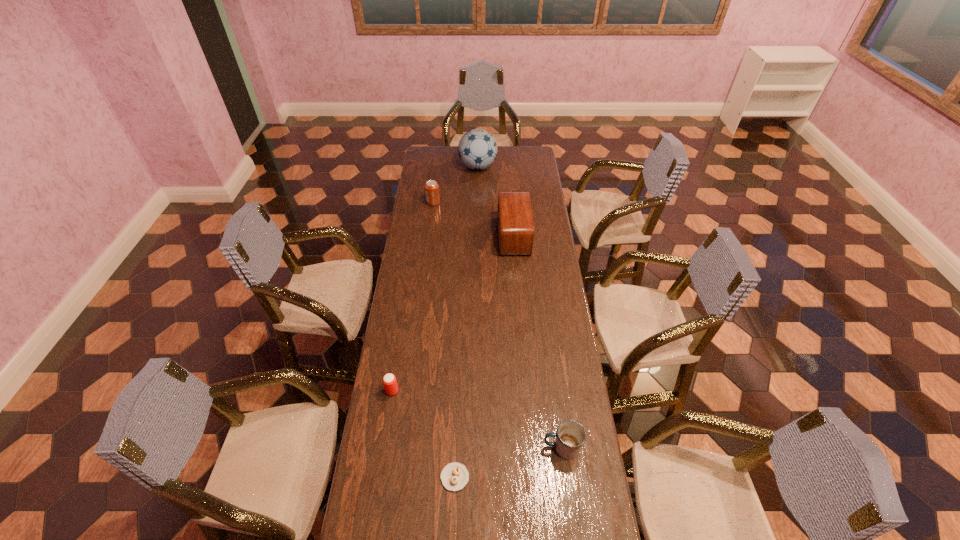
Where is `vacant space at the far left corner of the desktop`? vacant space at the far left corner of the desktop is located at coordinates (440, 160).

In the image, there is a desktop. Where is `vacant space at the far right corner`? The height and width of the screenshot is (540, 960). vacant space at the far right corner is located at coordinates (527, 152).

Image resolution: width=960 pixels, height=540 pixels. What are the coordinates of `empty space between the fifth farthest object and the second tallest object` in the screenshot? It's located at (538, 342).

Where is `free spot between the nearest object and the fourth farthest object`? This screenshot has width=960, height=540. free spot between the nearest object and the fourth farthest object is located at coordinates (423, 434).

Find the location of a particular element. free space between the farthest object and the second shortest object is located at coordinates (435, 279).

I want to click on free space between the can and the beer can, so click(x=413, y=297).

Locate an element on the screen. The height and width of the screenshot is (540, 960). vacant area that lies between the soccer ball and the fourth nearest object is located at coordinates (495, 201).

Identify the location of unoccupied position between the second farthest object and the radio receiver. The width and height of the screenshot is (960, 540). (473, 219).

Locate an element on the screen. The image size is (960, 540). vacant space that is in between the nearest object and the third shortest object is located at coordinates (509, 463).

The image size is (960, 540). I want to click on vacant area that lies between the mug and the third farthest object, so click(538, 342).